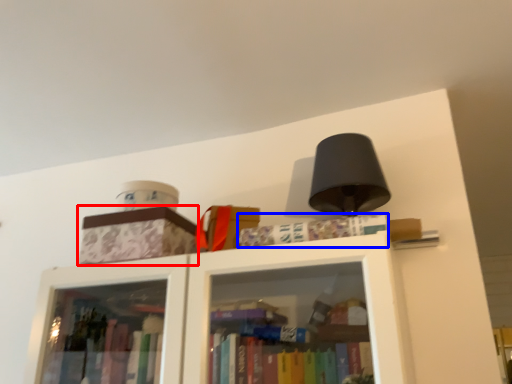
Question: Which point is closer to the camera, cardboard box (highlighted by a red box) or book (highlighted by a blue box)?

Choices:
 (A) cardboard box
 (B) book

Answer: (B)